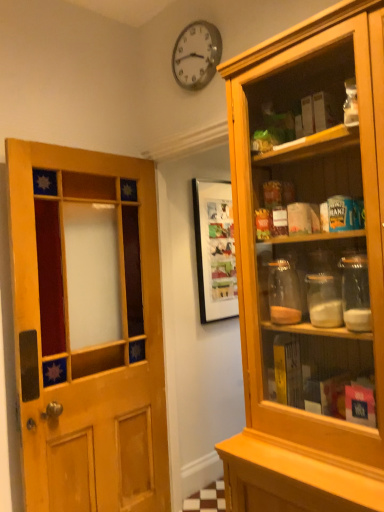
Question: Is wooden door at left looking in the opposite direction of metallic clock at upper center?

Choices:
 (A) no
 (B) yes

Answer: (A)

Question: From the image's perspective, is wooden door at left over metallic clock at upper center?

Choices:
 (A) yes
 (B) no

Answer: (B)

Question: Does wooden door at left have a lesser height compared to metallic clock at upper center?

Choices:
 (A) no
 (B) yes

Answer: (A)

Question: From the image's perspective, would you say wooden door at left is shown under metallic clock at upper center?

Choices:
 (A) yes
 (B) no

Answer: (A)

Question: Would you say wooden door at left is outside metallic clock at upper center?

Choices:
 (A) no
 (B) yes

Answer: (B)

Question: From a real-world perspective, does wooden door at left stand above metallic clock at upper center?

Choices:
 (A) no
 (B) yes

Answer: (A)

Question: Is metallic clock at upper center wider than wooden door at left?

Choices:
 (A) yes
 (B) no

Answer: (B)

Question: Is metallic clock at upper center to the left of wooden door at left from the viewer's perspective?

Choices:
 (A) yes
 (B) no

Answer: (B)

Question: From the image's perspective, does metallic clock at upper center appear lower than wooden door at left?

Choices:
 (A) no
 (B) yes

Answer: (A)

Question: Does metallic clock at upper center have a lesser height compared to wooden door at left?

Choices:
 (A) yes
 (B) no

Answer: (A)

Question: Are metallic clock at upper center and wooden door at left making contact?

Choices:
 (A) yes
 (B) no

Answer: (B)

Question: Is wooden door at left a part of metallic clock at upper center?

Choices:
 (A) yes
 (B) no

Answer: (B)

Question: Do you think metallic clock at upper center is within wooden door at left, or outside of it?

Choices:
 (A) outside
 (B) inside

Answer: (A)